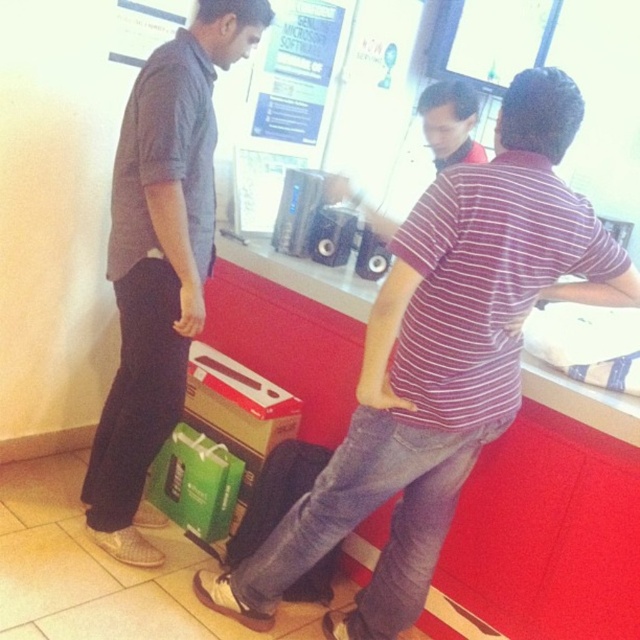
You are a store employee who needs to hand a customer a form. The form is on the counter between the striped cotton shirt at center and the dark gray shirt at left. Which shirt should you move first to access the form?

The striped cotton shirt at center is below the dark gray shirt at left, so you should move the dark gray shirt at left first to access the form.

You are a store employee who needs to hand a catalog to both the striped cotton shirt at center and the dark gray shirt at left. The catalog is 12 inches wide. Can you place the catalog between them without it overlapping either of them?

The distance between the striped cotton shirt at center and the dark gray shirt at left is 27.81 inches. Since the catalog is 12 inches wide, there is enough space to place it between them without overlapping. The remaining space would be 15.81 inches.

You are a customer trying to reach the speakers on the counter. You notice two people in front of you, a striped cotton shirt at center and a dark gray shirt at left. Which person might you need to ask to move first?

The striped cotton shirt at center is shorter than the dark gray shirt at left, so you should ask the striped cotton shirt at center to move first as they are closer to the counter and might be blocking your access.